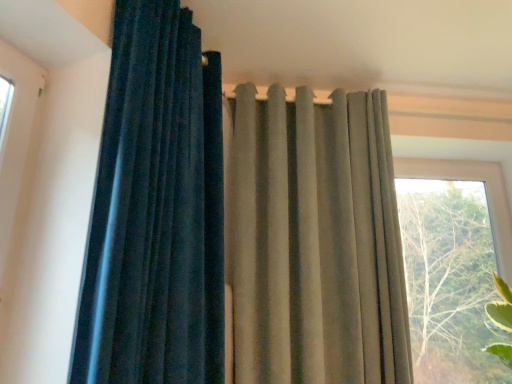
What do you see at coordinates (156, 210) in the screenshot? The height and width of the screenshot is (384, 512). I see `velvet dark blue curtain at left, acting as the first curtain starting from the left` at bounding box center [156, 210].

Based on the photo, measure the distance between satin beige curtain at upper center, which is the 1th curtain in right-to-left order, and camera.

A distance of 1.69 meters exists between satin beige curtain at upper center, which is the 1th curtain in right-to-left order, and camera.

Describe the element at coordinates (453, 265) in the screenshot. The image size is (512, 384). I see `transparent glass window at right` at that location.

The width and height of the screenshot is (512, 384). In order to click on velvet dark blue curtain at left, positioned as the second curtain in right-to-left order in this screenshot , I will do `click(156, 210)`.

Is velvet dark blue curtain at left, positioned as the second curtain in right-to-left order, wider than satin beige curtain at upper center, which is the 1th curtain in right-to-left order?

Indeed, velvet dark blue curtain at left, positioned as the second curtain in right-to-left order, has a greater width compared to satin beige curtain at upper center, which is the 1th curtain in right-to-left order.

From the image's perspective, which is above, velvet dark blue curtain at left, acting as the first curtain starting from the left, or satin beige curtain at upper center, which is the 1th curtain in right-to-left order?

velvet dark blue curtain at left, acting as the first curtain starting from the left, appears higher in the image.

Is velvet dark blue curtain at left, acting as the first curtain starting from the left, positioned with its back to satin beige curtain at upper center, which is the 1th curtain in right-to-left order?

No.

Is point (179, 297) in front of point (343, 220)?

Yes.

Considering the relative positions of transparent glass window at right and satin beige curtain at upper center, which is the second curtain from left to right, in the image provided, is transparent glass window at right to the right of satin beige curtain at upper center, which is the second curtain from left to right, from the viewer's perspective?

Indeed, transparent glass window at right is positioned on the right side of satin beige curtain at upper center, which is the second curtain from left to right.

From the image's perspective, which object appears higher, transparent glass window at right or satin beige curtain at upper center, which is the second curtain from left to right?

satin beige curtain at upper center, which is the second curtain from left to right.

Looking at the image, does transparent glass window at right seem bigger or smaller compared to satin beige curtain at upper center, which is the second curtain from left to right?

transparent glass window at right is smaller than satin beige curtain at upper center, which is the second curtain from left to right.

Does transparent glass window at right turn towards satin beige curtain at upper center, which is the second curtain from left to right?

No, transparent glass window at right is not facing towards satin beige curtain at upper center, which is the second curtain from left to right.

Consider the image. From a real-world perspective, relative to transparent glass window at right, is velvet dark blue curtain at left, acting as the first curtain starting from the left, vertically above or below?

From a real-world perspective, velvet dark blue curtain at left, acting as the first curtain starting from the left, is physically above transparent glass window at right.

Which object is more forward, velvet dark blue curtain at left, positioned as the second curtain in right-to-left order, or transparent glass window at right?

velvet dark blue curtain at left, positioned as the second curtain in right-to-left order, is closer to the camera.

Is velvet dark blue curtain at left, acting as the first curtain starting from the left, looking in the opposite direction of transparent glass window at right?

No, velvet dark blue curtain at left, acting as the first curtain starting from the left,'s orientation is not away from transparent glass window at right.

Which is less distant, (x=116, y=172) or (x=465, y=162)?

Positioned in front is point (x=116, y=172).

Between point (379, 155) and point (108, 160), which one is positioned in front?

Positioned in front is point (108, 160).

From the picture: Can you confirm if satin beige curtain at upper center, which is the 1th curtain in right-to-left order, is taller than velvet dark blue curtain at left, acting as the first curtain starting from the left?

Yes.

Can you tell me how much satin beige curtain at upper center, which is the 1th curtain in right-to-left order, and velvet dark blue curtain at left, positioned as the second curtain in right-to-left order, differ in facing direction?

The angular difference between satin beige curtain at upper center, which is the 1th curtain in right-to-left order, and velvet dark blue curtain at left, positioned as the second curtain in right-to-left order, is 57 degrees.

Where is `curtain on the right of velvet dark blue curtain at left, acting as the first curtain starting from the left`? The image size is (512, 384). curtain on the right of velvet dark blue curtain at left, acting as the first curtain starting from the left is located at coordinates (315, 241).

Is transparent glass window at right inside the boundaries of velvet dark blue curtain at left, positioned as the second curtain in right-to-left order, or outside?

transparent glass window at right is outside velvet dark blue curtain at left, positioned as the second curtain in right-to-left order.

Looking at their sizes, would you say transparent glass window at right is wider or thinner than velvet dark blue curtain at left, acting as the first curtain starting from the left?

Clearly, transparent glass window at right has less width compared to velvet dark blue curtain at left, acting as the first curtain starting from the left.

Is transparent glass window at right beside velvet dark blue curtain at left, acting as the first curtain starting from the left?

No, transparent glass window at right is not in contact with velvet dark blue curtain at left, acting as the first curtain starting from the left.

Between transparent glass window at right and velvet dark blue curtain at left, acting as the first curtain starting from the left, which one has less height?

transparent glass window at right.

Could you tell me if satin beige curtain at upper center, which is the 1th curtain in right-to-left order, is facing transparent glass window at right?

No, satin beige curtain at upper center, which is the 1th curtain in right-to-left order, is not turned towards transparent glass window at right.

From the image's perspective, which one is positioned lower, satin beige curtain at upper center, which is the 1th curtain in right-to-left order, or transparent glass window at right?

transparent glass window at right, from the image's perspective.

From a real-world perspective, which is physically above, satin beige curtain at upper center, which is the 1th curtain in right-to-left order, or transparent glass window at right?

From a 3D spatial view, satin beige curtain at upper center, which is the 1th curtain in right-to-left order, is above.

Is satin beige curtain at upper center, which is the 1th curtain in right-to-left order, not inside transparent glass window at right?

Yes.

Image resolution: width=512 pixels, height=384 pixels. In the image, there is a velvet dark blue curtain at left, positioned as the second curtain in right-to-left order. What are the coordinates of `curtain below it (from a real-world perspective)` in the screenshot? It's located at (315, 241).

You are a GUI agent. You are given a task and a screenshot of the screen. Output one action in this format:
    pyautogui.click(x=<x>, y=<y>)
    Task: Click on the window behind the satin beige curtain at upper center, which is the 1th curtain in right-to-left order
    This screenshot has width=512, height=384.
    Given the screenshot: What is the action you would take?
    pyautogui.click(x=453, y=265)

Estimate the real-world distances between objects in this image. Which object is further from velvet dark blue curtain at left, positioned as the second curtain in right-to-left order, satin beige curtain at upper center, which is the second curtain from left to right, or transparent glass window at right?

transparent glass window at right lies further to velvet dark blue curtain at left, positioned as the second curtain in right-to-left order, than the other object.

Consider the image. Based on their spatial positions, is velvet dark blue curtain at left, acting as the first curtain starting from the left, or satin beige curtain at upper center, which is the 1th curtain in right-to-left order, closer to transparent glass window at right?

satin beige curtain at upper center, which is the 1th curtain in right-to-left order, lies closer to transparent glass window at right than the other object.

When comparing their distances from satin beige curtain at upper center, which is the second curtain from left to right, does velvet dark blue curtain at left, acting as the first curtain starting from the left, or transparent glass window at right seem closer?

velvet dark blue curtain at left, acting as the first curtain starting from the left, lies closer to satin beige curtain at upper center, which is the second curtain from left to right, than the other object.

Considering their positions, is transparent glass window at right positioned closer to satin beige curtain at upper center, which is the 1th curtain in right-to-left order, than velvet dark blue curtain at left, acting as the first curtain starting from the left?

velvet dark blue curtain at left, acting as the first curtain starting from the left.

Which object lies further to the anchor point transparent glass window at right, satin beige curtain at upper center, which is the 1th curtain in right-to-left order, or velvet dark blue curtain at left, positioned as the second curtain in right-to-left order?

velvet dark blue curtain at left, positioned as the second curtain in right-to-left order, is positioned further to the anchor transparent glass window at right.

Based on their spatial positions, is transparent glass window at right or satin beige curtain at upper center, which is the second curtain from left to right, closer to velvet dark blue curtain at left, positioned as the second curtain in right-to-left order?

satin beige curtain at upper center, which is the second curtain from left to right, is positioned closer to the anchor velvet dark blue curtain at left, positioned as the second curtain in right-to-left order.

Where is `curtain between velvet dark blue curtain at left, positioned as the second curtain in right-to-left order, and transparent glass window at right, in the horizontal direction`? This screenshot has height=384, width=512. curtain between velvet dark blue curtain at left, positioned as the second curtain in right-to-left order, and transparent glass window at right, in the horizontal direction is located at coordinates (315, 241).